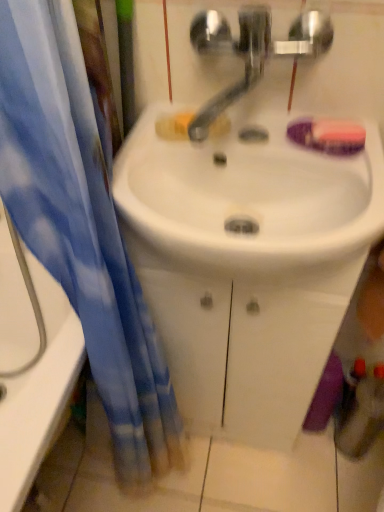
Question: Considering the relative sizes of blue fabric curtain at left and white glossy sink at center in the image provided, is blue fabric curtain at left smaller than white glossy sink at center?

Choices:
 (A) no
 (B) yes

Answer: (A)

Question: From the image's perspective, is blue fabric curtain at left below white glossy sink at center?

Choices:
 (A) yes
 (B) no

Answer: (A)

Question: Is blue fabric curtain at left thinner than white glossy sink at center?

Choices:
 (A) no
 (B) yes

Answer: (B)

Question: Is blue fabric curtain at left positioned behind white glossy sink at center?

Choices:
 (A) yes
 (B) no

Answer: (B)

Question: From a real-world perspective, is blue fabric curtain at left physically below white glossy sink at center?

Choices:
 (A) no
 (B) yes

Answer: (B)

Question: Does blue fabric curtain at left turn towards white glossy sink at center?

Choices:
 (A) no
 (B) yes

Answer: (A)

Question: From a real-world perspective, is white glossy bathtub at left beneath purple matte soap at upper right?

Choices:
 (A) no
 (B) yes

Answer: (B)

Question: Is white glossy bathtub at left positioned far away from purple matte soap at upper right?

Choices:
 (A) no
 (B) yes

Answer: (A)

Question: Does white glossy bathtub at left contain purple matte soap at upper right?

Choices:
 (A) yes
 (B) no

Answer: (B)

Question: Is white glossy bathtub at left positioned beyond the bounds of purple matte soap at upper right?

Choices:
 (A) no
 (B) yes

Answer: (B)

Question: From the image's perspective, does white glossy bathtub at left appear higher than purple matte soap at upper right?

Choices:
 (A) yes
 (B) no

Answer: (B)

Question: Can you confirm if white glossy bathtub at left is taller than purple matte soap at upper right?

Choices:
 (A) no
 (B) yes

Answer: (B)

Question: Is blue fabric curtain at left oriented towards satin nickel faucet at center?

Choices:
 (A) yes
 (B) no

Answer: (B)